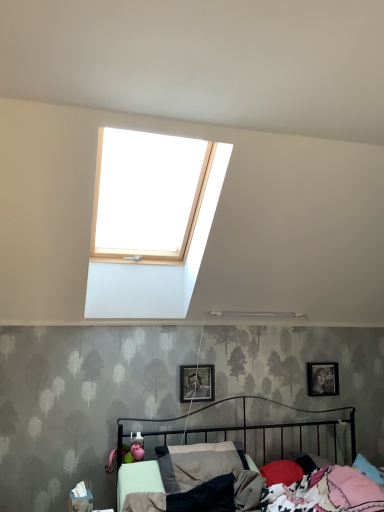
Question: From the image's perspective, is metallic silver photo frame at right, placed as the first picture frame when sorted from right to left, located above or below metallic silver photo frame at center, the 1th picture frame when ordered from left to right?

Choices:
 (A) below
 (B) above

Answer: (A)

Question: Considering the relative positions of metallic silver photo frame at right, which appears as the 1th picture frame when viewed from the back, and metallic silver photo frame at center, the 1th picture frame when ordered from left to right, in the image provided, is metallic silver photo frame at right, which appears as the 1th picture frame when viewed from the back, to the left or to the right of metallic silver photo frame at center, the 1th picture frame when ordered from left to right,?

Choices:
 (A) left
 (B) right

Answer: (B)

Question: Which of these objects is positioned farthest from the metallic black bed at lower center?

Choices:
 (A) metallic silver photo frame at center, the 1th picture frame from the front
 (B) metallic silver photo frame at right, which appears as the 1th picture frame when viewed from the back

Answer: (B)

Question: Considering the real-world distances, which object is farthest from the metallic black bed at lower center?

Choices:
 (A) metallic silver photo frame at center, the 1th picture frame from the front
 (B) metallic silver photo frame at right, which appears as the 1th picture frame when viewed from the back

Answer: (B)